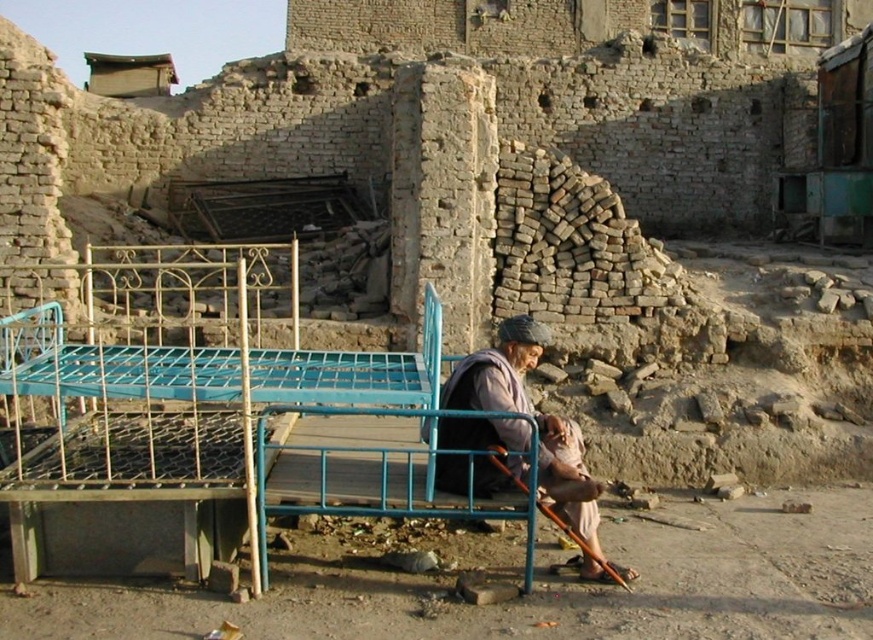
Is blue metal bed at center to the right of light brown fabric at center from the viewer's perspective?

Incorrect, blue metal bed at center is not on the right side of light brown fabric at center.

Can you confirm if blue metal bed at center is wider than light brown fabric at center?

Correct, the width of blue metal bed at center exceeds that of light brown fabric at center.

Measure the distance between blue metal bed at center and camera.

9.11 meters

What are the coordinates of `blue metal bed at center` in the screenshot? It's located at (172, 380).